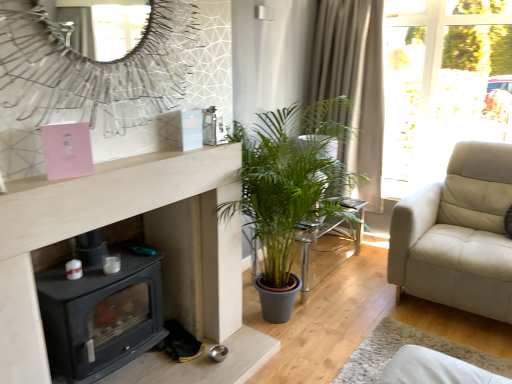
Question: Is point (358, 31) closer or farther from the camera than point (301, 276)?

Choices:
 (A) closer
 (B) farther

Answer: (B)

Question: From a real-world perspective, relative to translucent glass table at center, is beige textured curtain at upper right vertically above or below?

Choices:
 (A) above
 (B) below

Answer: (A)

Question: Estimate the real-world distances between objects in this image. Which object is farther from the metallic silver mirror at upper center?

Choices:
 (A) beige textured curtain at upper right
 (B) black matte wood burning stove at lower left
 (C) translucent glass table at center

Answer: (A)

Question: Which of these objects is positioned farthest from the beige textured curtain at upper right?

Choices:
 (A) black matte wood burning stove at lower left
 (B) translucent glass table at center
 (C) metallic silver mirror at upper center

Answer: (A)